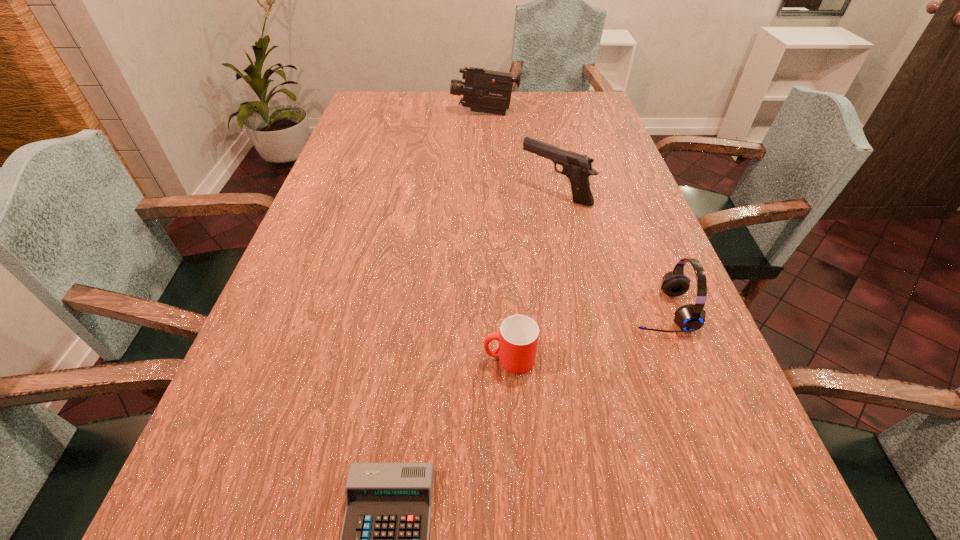
In order to click on the farthest object in this screenshot , I will do `click(486, 91)`.

You are a GUI agent. You are given a task and a screenshot of the screen. Output one action in this format:
    pyautogui.click(x=<x>, y=<y>)
    Task: Click on the gun
    
    Given the screenshot: What is the action you would take?
    pyautogui.click(x=577, y=167)

Locate an element on the screen. Image resolution: width=960 pixels, height=540 pixels. the rightmost object is located at coordinates (691, 317).

The image size is (960, 540). In order to click on headset in this screenshot , I will do `click(691, 317)`.

Locate an element on the screen. the second nearest object is located at coordinates (518, 336).

The width and height of the screenshot is (960, 540). What are the coordinates of `cup` in the screenshot? It's located at (518, 336).

I want to click on vacant space situated 0.120m on the front-facing side of the camcorder, so click(418, 114).

I want to click on free location located 0.200m on the front-facing side of the camcorder, so click(395, 114).

The height and width of the screenshot is (540, 960). I want to click on vacant space located on the front-facing side of the camcorder, so click(397, 114).

Find the location of `blank area located at the muzzle of the second farthest object`. blank area located at the muzzle of the second farthest object is located at coordinates (409, 193).